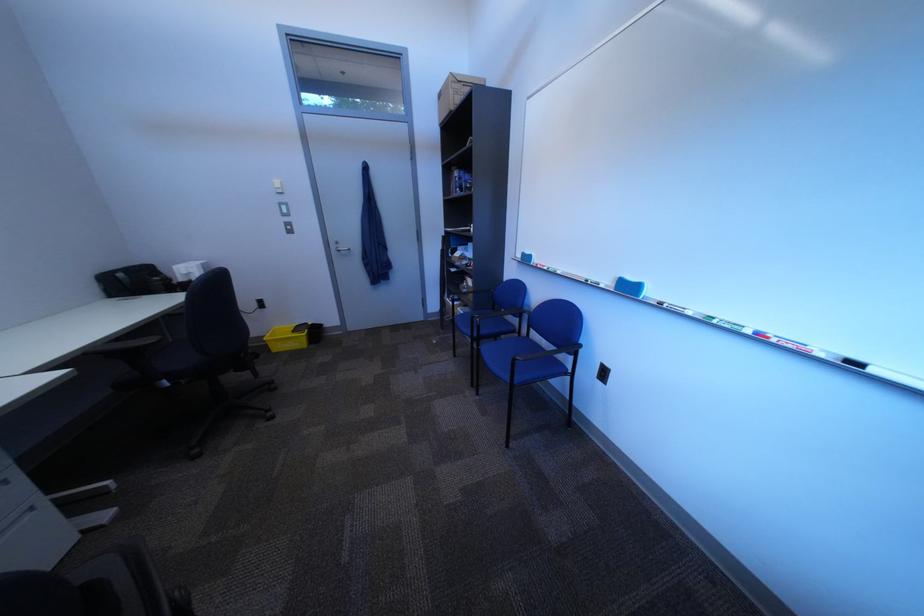
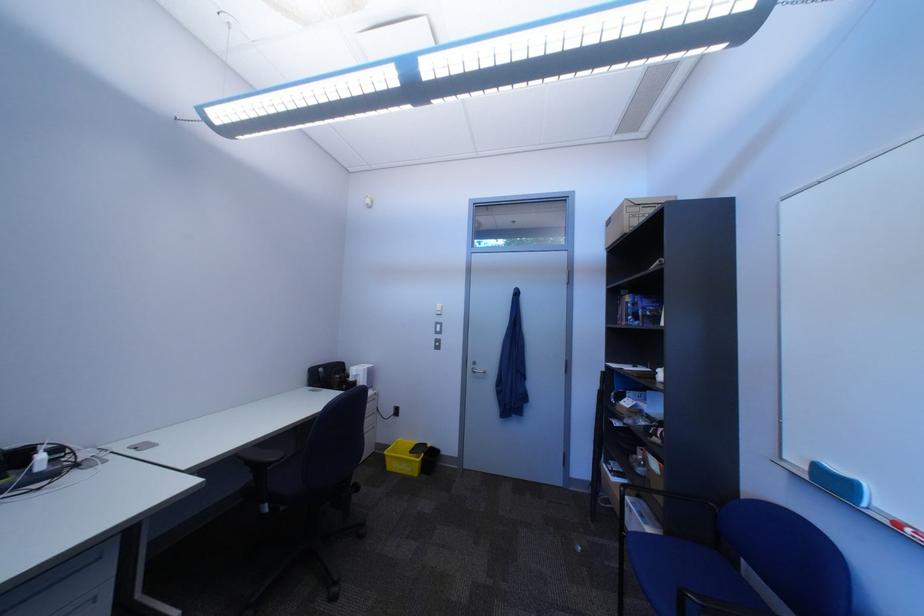
Where in the second image is the point corresponding to point 552,267 from the first image?

(915, 527)